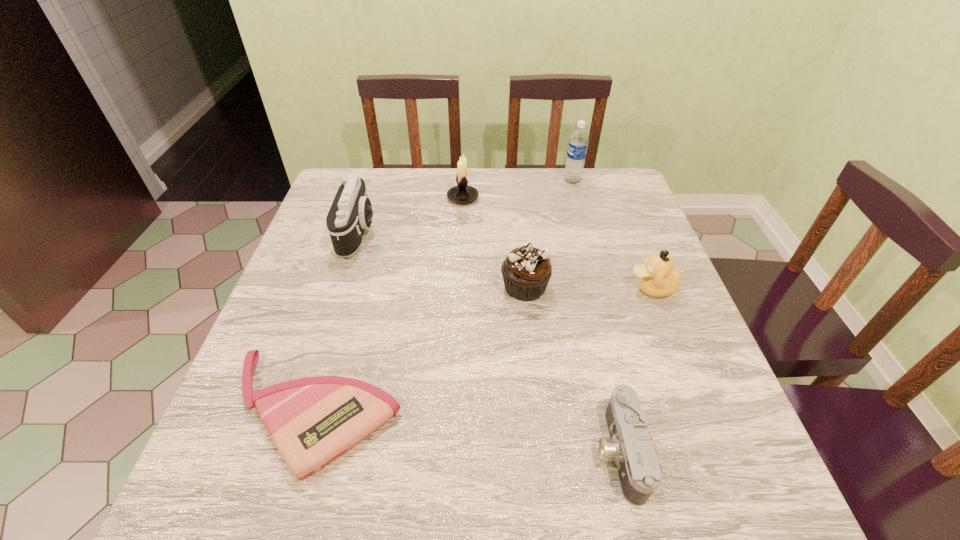
Where is `vacant space that satisfies the following two spatial constraints: 1. on the front side of the candle holder; 2. on the front lens of the farther camera`? The image size is (960, 540). vacant space that satisfies the following two spatial constraints: 1. on the front side of the candle holder; 2. on the front lens of the farther camera is located at coordinates (461, 233).

The width and height of the screenshot is (960, 540). I want to click on free spot that satisfies the following two spatial constraints: 1. on the front lens of the farther camera; 2. on the left side of the shortest object, so click(x=302, y=411).

The width and height of the screenshot is (960, 540). I want to click on free location that satisfies the following two spatial constraints: 1. on the back side of the fourth object from right to left; 2. on the right side of the wristlet, so click(x=351, y=287).